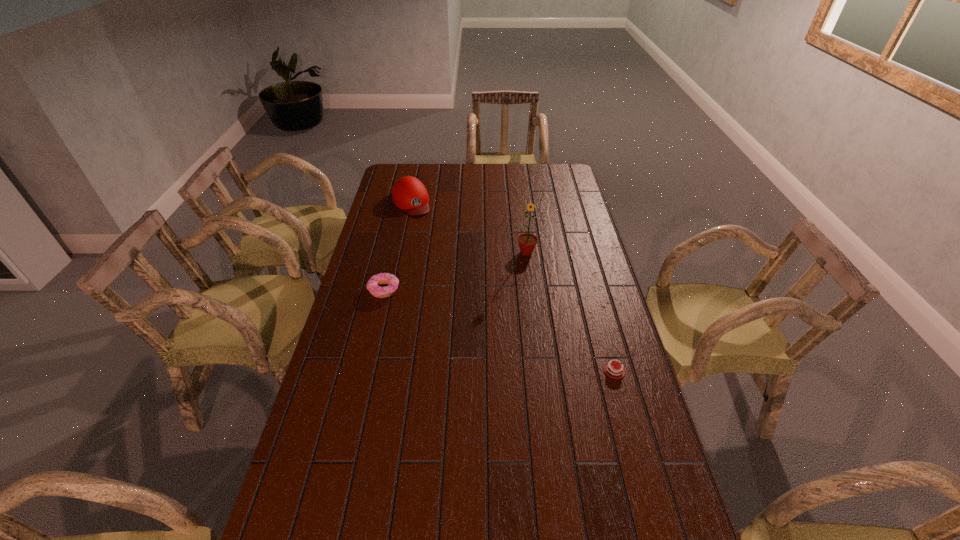
This screenshot has width=960, height=540. I want to click on vacant space on the desktop that is between the doughnut and the rightmost object and is positioned on the front-facing side of the third shortest object, so click(x=494, y=328).

The height and width of the screenshot is (540, 960). In order to click on vacant space on the desktop that is between the doughnut and the chocolate cake and is positioned on the face of the third object from left to right in this screenshot , I will do `click(514, 335)`.